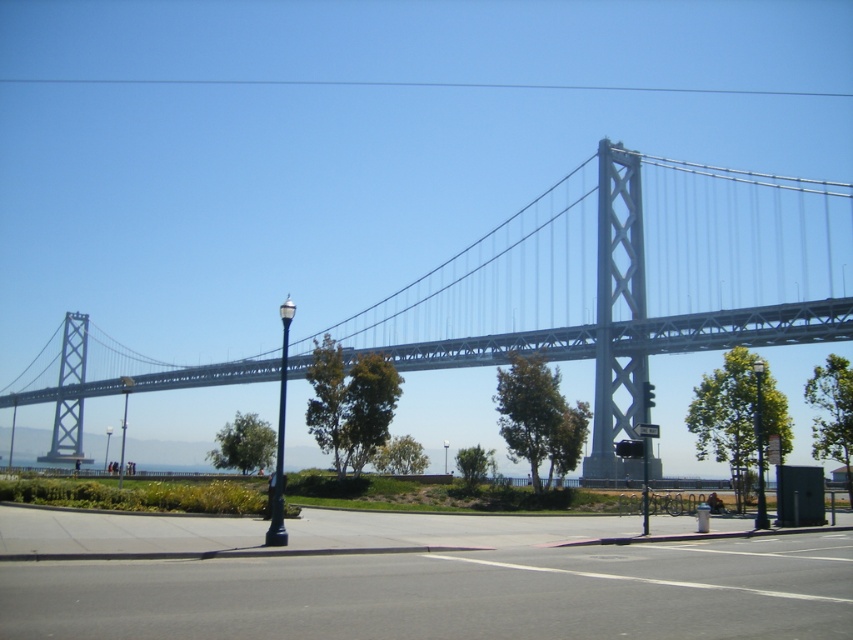
Question: Which object appears farthest from the camera in this image?

Choices:
 (A) metallic streetlight at center
 (B) red glass traffic light at center

Answer: (A)

Question: Can you confirm if metallic streetlamp at center is smaller than red glass traffic light at center?

Choices:
 (A) no
 (B) yes

Answer: (A)

Question: Which point is closer to the camera?

Choices:
 (A) (274, 508)
 (B) (445, 452)
 (C) (758, 376)

Answer: (A)

Question: Observing the image, what is the correct spatial positioning of polished metal streetlight at center in reference to red glass traffic light at center?

Choices:
 (A) below
 (B) above

Answer: (B)

Question: Can you confirm if metallic gray bridge at center is bigger than black metal lamp post at right?

Choices:
 (A) no
 (B) yes

Answer: (B)

Question: Which point is closer to the camera?

Choices:
 (A) black metal lamp post at right
 (B) red glass traffic light at center

Answer: (A)